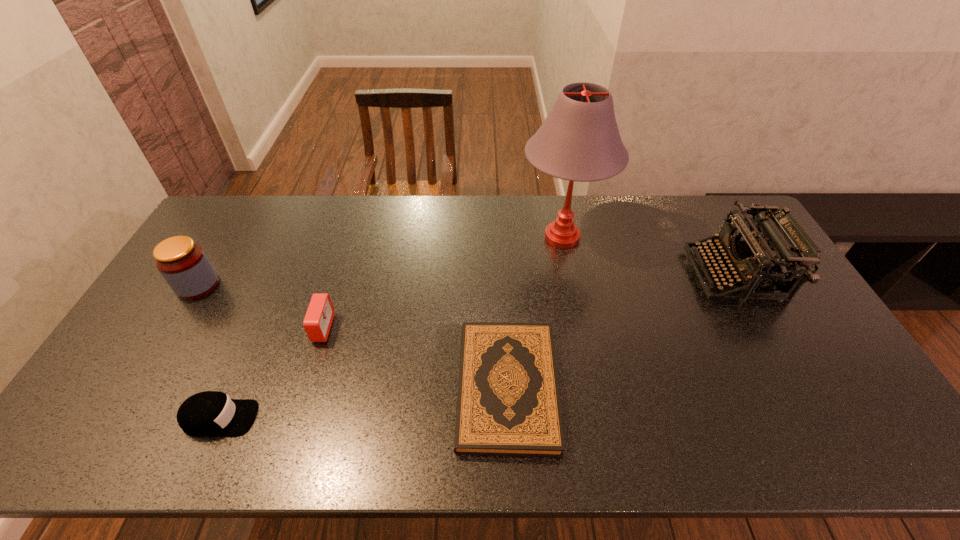
Identify the location of vacant point located between the jar and the fifth object from right to left. The image size is (960, 540). (208, 352).

At what (x,y) coordinates should I click in order to perform the action: click on free space that is in between the fifth object from right to left and the third tallest object. Please return your answer as a coordinate pair (x, y). The width and height of the screenshot is (960, 540). Looking at the image, I should click on (208, 352).

Locate an element on the screen. The height and width of the screenshot is (540, 960). free area in between the fourth object from right to left and the fourth shortest object is located at coordinates click(x=260, y=307).

Where is `free point between the tallest object and the fourth tallest object`? The width and height of the screenshot is (960, 540). free point between the tallest object and the fourth tallest object is located at coordinates (442, 283).

Where is `empty space that is in between the leftmost object and the second object from left to right`? empty space that is in between the leftmost object and the second object from left to right is located at coordinates (208, 352).

The width and height of the screenshot is (960, 540). In order to click on object identified as the fifth closest to the cap in this screenshot , I will do `click(773, 237)`.

Locate which object is the fourth closest to the jar. Please provide its 2D coordinates. Your answer should be formatted as a tuple, i.e. [(x, y)], where the tuple contains the x and y coordinates of a point satisfying the conditions above.

[(579, 140)]

Where is `vacant area in the image that satisfies the following two spatial constraints: 1. on the front side of the shortest object; 2. on the front-facing side of the second object from left to right`? The width and height of the screenshot is (960, 540). vacant area in the image that satisfies the following two spatial constraints: 1. on the front side of the shortest object; 2. on the front-facing side of the second object from left to right is located at coordinates (509, 418).

Identify the location of free region that satisfies the following two spatial constraints: 1. on the front side of the hardback book; 2. on the left side of the jar. (135, 388).